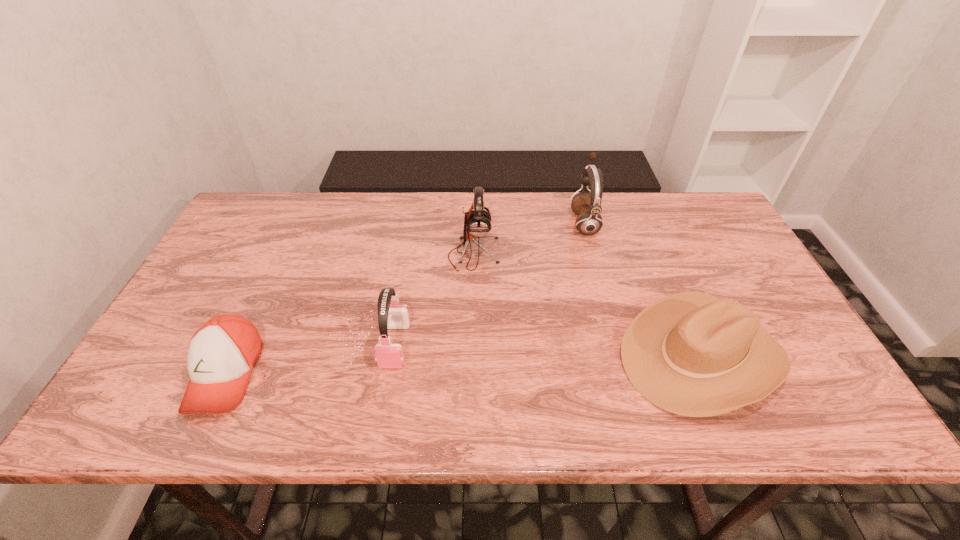
Locate an element on the screen. blank space at the near edge of the desktop is located at coordinates (520, 428).

Find the location of a particular element. The image size is (960, 540). free space at the left edge of the desktop is located at coordinates (228, 307).

Where is `free spot at the right edge of the desktop`? The width and height of the screenshot is (960, 540). free spot at the right edge of the desktop is located at coordinates (714, 275).

You are a GUI agent. You are given a task and a screenshot of the screen. Output one action in this format:
    pyautogui.click(x=<x>, y=<y>)
    Task: Click on the free region at the far left corner of the desktop
    This screenshot has height=540, width=960.
    Given the screenshot: What is the action you would take?
    pyautogui.click(x=234, y=225)

The height and width of the screenshot is (540, 960). I want to click on vacant space at the near left corner, so click(x=158, y=406).

Find the location of a particular element. empty space between the nearest earphone and the second shortest object is located at coordinates (548, 350).

The width and height of the screenshot is (960, 540). In order to click on vacant region between the third object from right to left and the shortest earphone in this screenshot , I will do `click(435, 300)`.

Image resolution: width=960 pixels, height=540 pixels. I want to click on empty location between the leftmost earphone and the baseball cap, so click(310, 359).

Identify the location of free space between the shortest object and the second earphone from left to right. Image resolution: width=960 pixels, height=540 pixels. (349, 314).

Where is `vacant area that lies between the rightmost earphone and the second earphone from left to right`? This screenshot has height=540, width=960. vacant area that lies between the rightmost earphone and the second earphone from left to right is located at coordinates tap(529, 238).